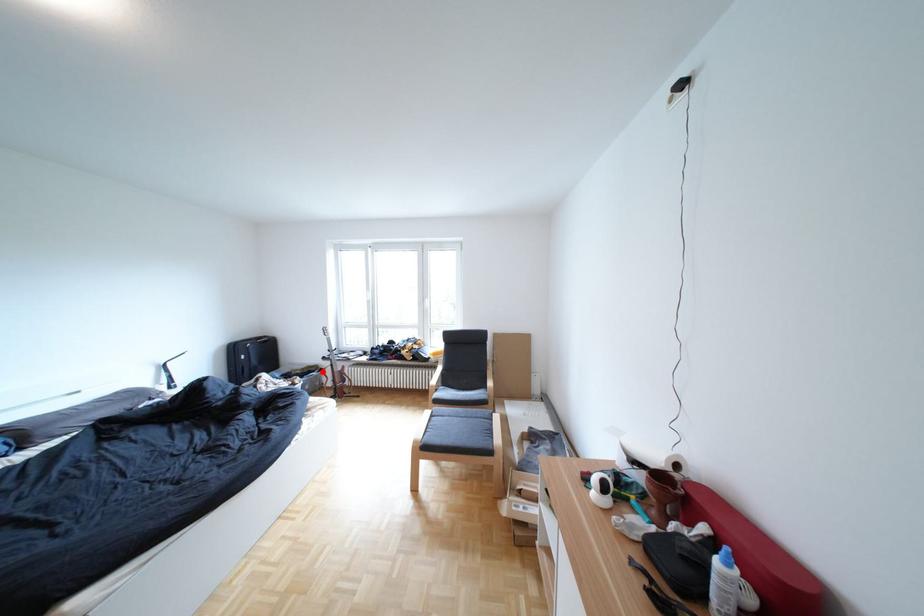
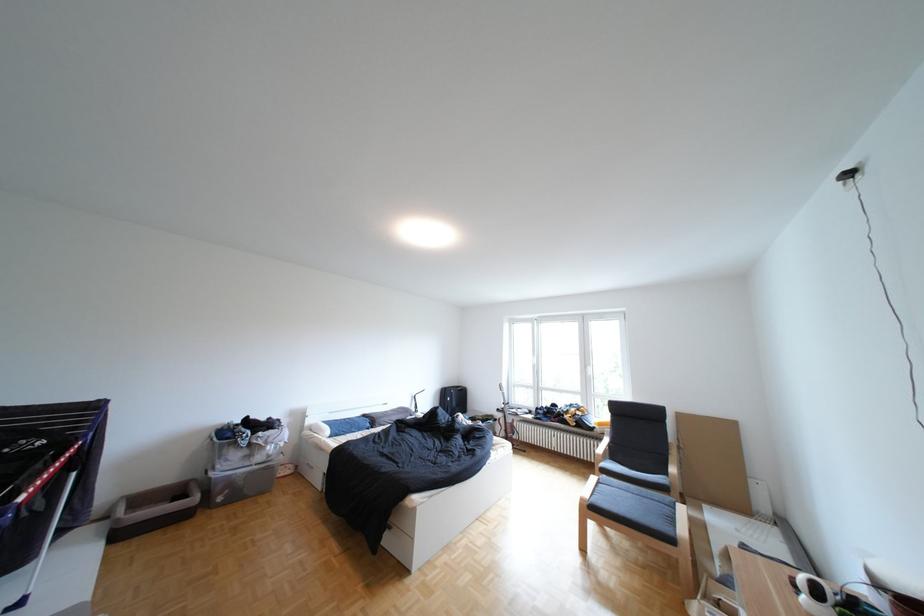
Question: I am providing you with two images of the same scene from different viewpoints. Given a red point in image1, look at the same physical point in image2. Is it:

Choices:
 (A) Closer to the viewpoint
 (B) Farther from the viewpoint

Answer: (B)